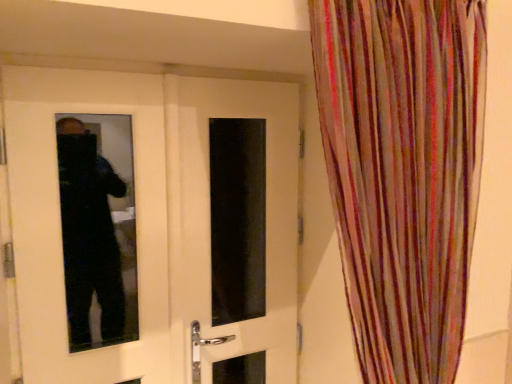
Question: From a real-world perspective, is white glossy door at center, which appears as the 1th door when viewed from the left, under multicolored sheer curtain at right?

Choices:
 (A) yes
 (B) no

Answer: (A)

Question: Considering the relative sizes of white glossy door at center, which appears as the 1th door when viewed from the left, and multicolored sheer curtain at right in the image provided, is white glossy door at center, which appears as the 1th door when viewed from the left, wider than multicolored sheer curtain at right?

Choices:
 (A) yes
 (B) no

Answer: (B)

Question: Is white glossy door at center, the 2th door in the right-to-left sequence, smaller than multicolored sheer curtain at right?

Choices:
 (A) no
 (B) yes

Answer: (B)

Question: Is white glossy door at center, which appears as the 1th door when viewed from the left, thinner than multicolored sheer curtain at right?

Choices:
 (A) yes
 (B) no

Answer: (A)

Question: From the image's perspective, is white glossy door at center, which appears as the 1th door when viewed from the left, over multicolored sheer curtain at right?

Choices:
 (A) yes
 (B) no

Answer: (B)

Question: Is white glossy door at center, the 2th door positioned from the left, wider or thinner than multicolored sheer curtain at right?

Choices:
 (A) wide
 (B) thin

Answer: (B)

Question: Considering the positions of point 181,223 and point 323,112, is point 181,223 closer or farther from the camera than point 323,112?

Choices:
 (A) closer
 (B) farther

Answer: (B)

Question: In terms of height, does white glossy door at center, which is counted as the first door, starting from the right, look taller or shorter compared to multicolored sheer curtain at right?

Choices:
 (A) short
 (B) tall

Answer: (B)

Question: Relative to multicolored sheer curtain at right, is white glossy door at center, the 2th door positioned from the left, in front or behind?

Choices:
 (A) behind
 (B) front

Answer: (A)

Question: Considering the relative positions of white glossy door at center, which is counted as the first door, starting from the right, and white glossy door at center, the 2th door in the right-to-left sequence, in the image provided, is white glossy door at center, which is counted as the first door, starting from the right, to the left or to the right of white glossy door at center, the 2th door in the right-to-left sequence,?

Choices:
 (A) right
 (B) left

Answer: (A)

Question: In terms of width, does white glossy door at center, the 2th door positioned from the left, look wider or thinner when compared to white glossy door at center, the 2th door in the right-to-left sequence?

Choices:
 (A) wide
 (B) thin

Answer: (A)

Question: Looking at the image, does white glossy door at center, the 2th door positioned from the left, seem bigger or smaller compared to white glossy door at center, the 2th door in the right-to-left sequence?

Choices:
 (A) small
 (B) big

Answer: (A)

Question: From a real-world perspective, is white glossy door at center, the 2th door positioned from the left, positioned above or below white glossy door at center, the 2th door in the right-to-left sequence?

Choices:
 (A) above
 (B) below

Answer: (B)

Question: In terms of height, does multicolored sheer curtain at right look taller or shorter compared to white glossy door at center, the 2th door in the right-to-left sequence?

Choices:
 (A) tall
 (B) short

Answer: (B)

Question: Based on their sizes in the image, would you say multicolored sheer curtain at right is bigger or smaller than white glossy door at center, the 2th door in the right-to-left sequence?

Choices:
 (A) small
 (B) big

Answer: (B)